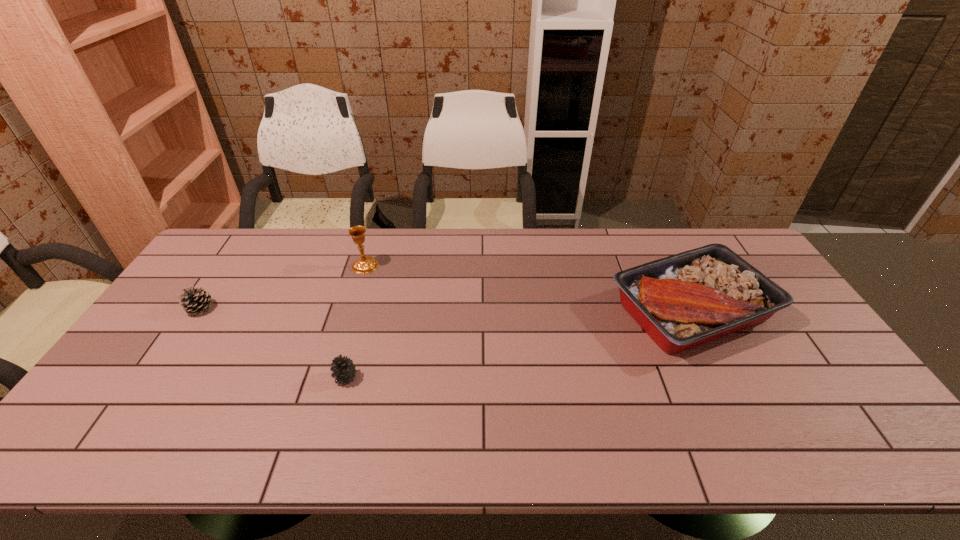
Identify which object is located as the second nearest to the third shortest object. Please provide its 2D coordinates. Your answer should be formatted as a tuple, i.e. [(x, y)], where the tuple contains the x and y coordinates of a point satisfying the conditions above.

[(367, 264)]

This screenshot has height=540, width=960. I want to click on the second closest object to the leftmost object, so click(x=343, y=368).

Find the location of a particular element. This screenshot has width=960, height=540. free spot that satisfies the following two spatial constraints: 1. on the front side of the farther pinecone; 2. on the left side of the third shortest object is located at coordinates (199, 312).

Image resolution: width=960 pixels, height=540 pixels. In order to click on free point that satisfies the following two spatial constraints: 1. on the front side of the tallest object; 2. on the right side of the rightmost object in this screenshot , I will do `click(351, 312)`.

The height and width of the screenshot is (540, 960). Find the location of `vacant space that satisfies the following two spatial constraints: 1. on the front side of the third shortest object; 2. on the right side of the farther pinecone`. vacant space that satisfies the following two spatial constraints: 1. on the front side of the third shortest object; 2. on the right side of the farther pinecone is located at coordinates [x=199, y=312].